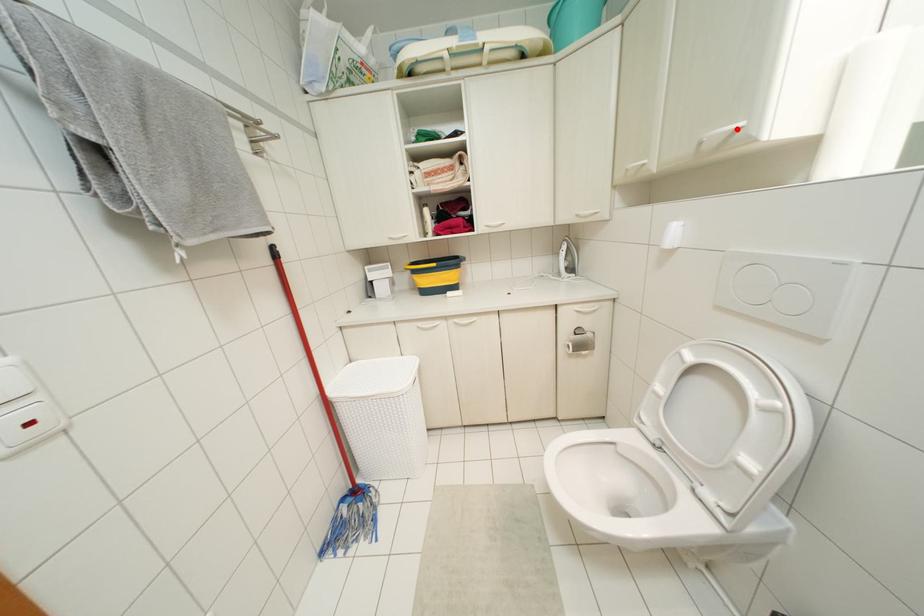
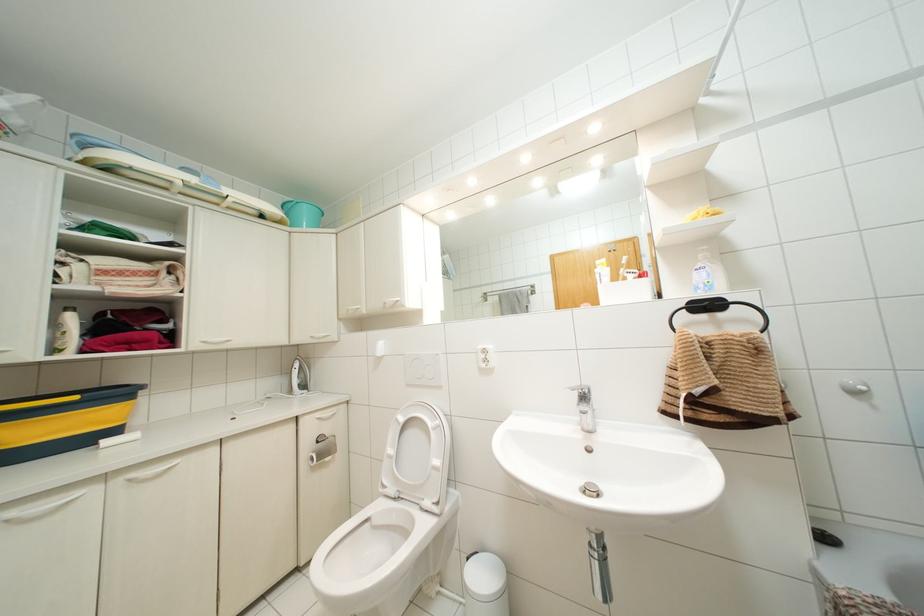
Question: I am providing you with two images of the same scene from different viewpoints. A red point is marked on the first image. Can you still see the location of the red point in image 2?

Choices:
 (A) Yes
 (B) No

Answer: (A)